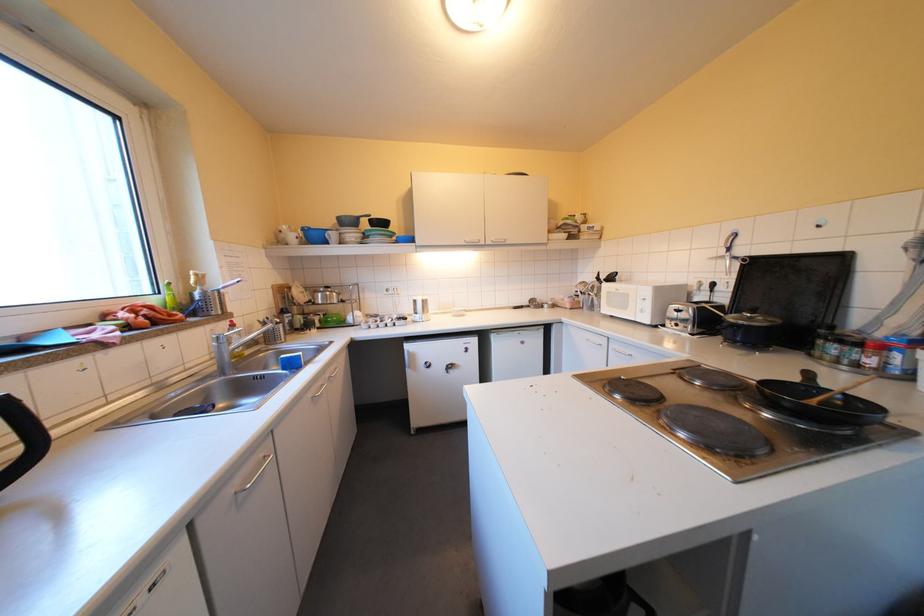
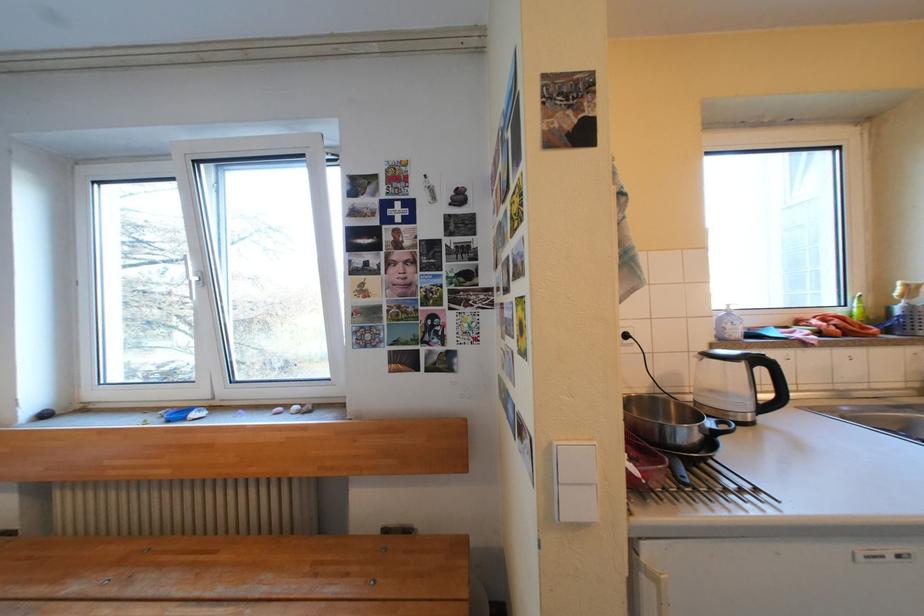
Question: The first image is from the beginning of the video and the second image is from the end. How did the camera likely rotate when shooting the video?

Choices:
 (A) Left
 (B) Right
 (C) Up
 (D) Down

Answer: (A)